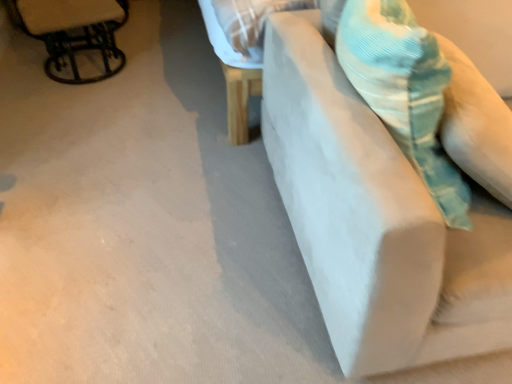
Question: Does point (425, 86) appear closer or farther from the camera than point (332, 130)?

Choices:
 (A) farther
 (B) closer

Answer: (B)

Question: Is corduroy teal throw pillow at upper right inside the boundaries of white fabric couch at right, or outside?

Choices:
 (A) outside
 (B) inside

Answer: (B)

Question: Estimate the real-world distances between objects in this image. Which object is closer to the metallic black chair at upper left?

Choices:
 (A) white fabric couch at right
 (B) corduroy teal throw pillow at upper right

Answer: (A)

Question: Considering the real-world distances, which object is farthest from the white fabric couch at right?

Choices:
 (A) corduroy teal throw pillow at upper right
 (B) metallic black chair at upper left

Answer: (B)